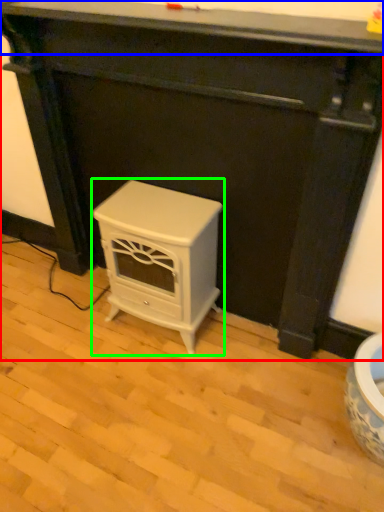
Question: Which is nearer to the furniture (highlighted by a red box)? counter top (highlighted by a blue box) or furniture (highlighted by a green box).

Choices:
 (A) counter top
 (B) furniture

Answer: (B)